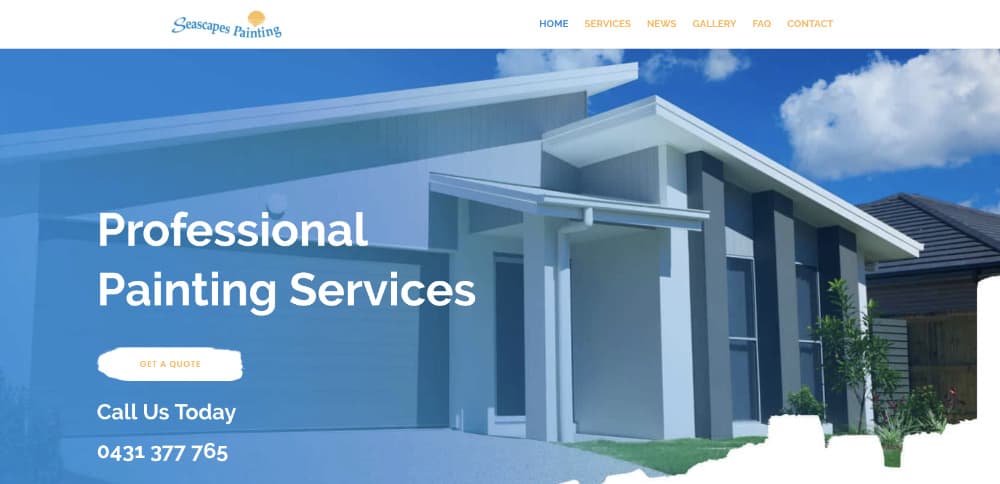
The height and width of the screenshot is (484, 1000). Identify the location of window. (738, 310).